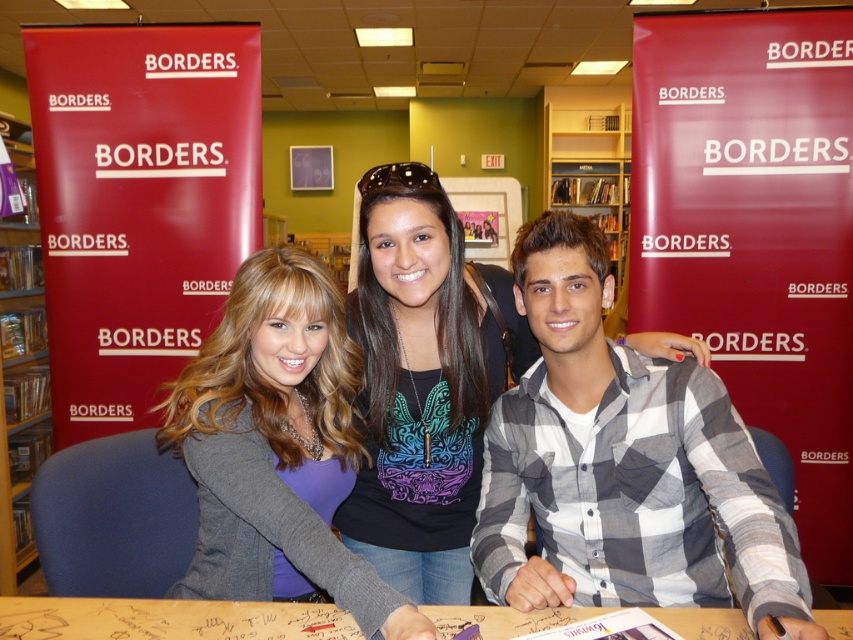
Question: Can you confirm if gray checkered shirt at center is smaller than black matte shirt at center?

Choices:
 (A) no
 (B) yes

Answer: (B)

Question: Which point appears closest to the camera in this image?

Choices:
 (A) (234, 371)
 (B) (793, 636)
 (C) (7, 486)

Answer: (B)

Question: Does gray sweater at center appear on the left side of wooden table at center?

Choices:
 (A) yes
 (B) no

Answer: (A)

Question: Which point appears closest to the camera in this image?

Choices:
 (A) (451, 353)
 (B) (215, 556)
 (C) (9, 433)
 (D) (199, 628)

Answer: (D)

Question: Which point is farther to the camera?

Choices:
 (A) (579, 157)
 (B) (405, 541)
 (C) (26, 428)
 (D) (675, 458)

Answer: (A)

Question: Is black matte shirt at center to the right of wooden table at center from the viewer's perspective?

Choices:
 (A) no
 (B) yes

Answer: (B)